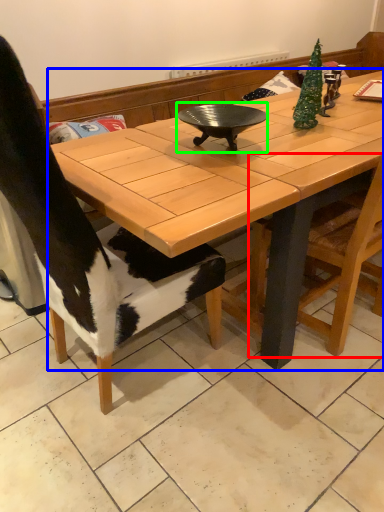
Question: Considering the real-world distances, which object is farthest from chair (highlighted by a red box)? coffee table (highlighted by a blue box) or wok (highlighted by a green box)?

Choices:
 (A) coffee table
 (B) wok

Answer: (B)